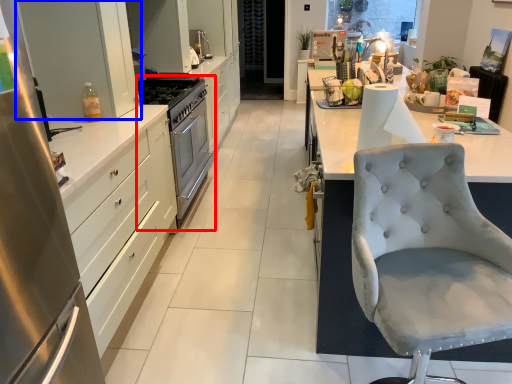
Question: Which object is closer to the camera taking this photo, sink (highlighted by a red box) or cabinetry (highlighted by a blue box)?

Choices:
 (A) sink
 (B) cabinetry

Answer: (B)